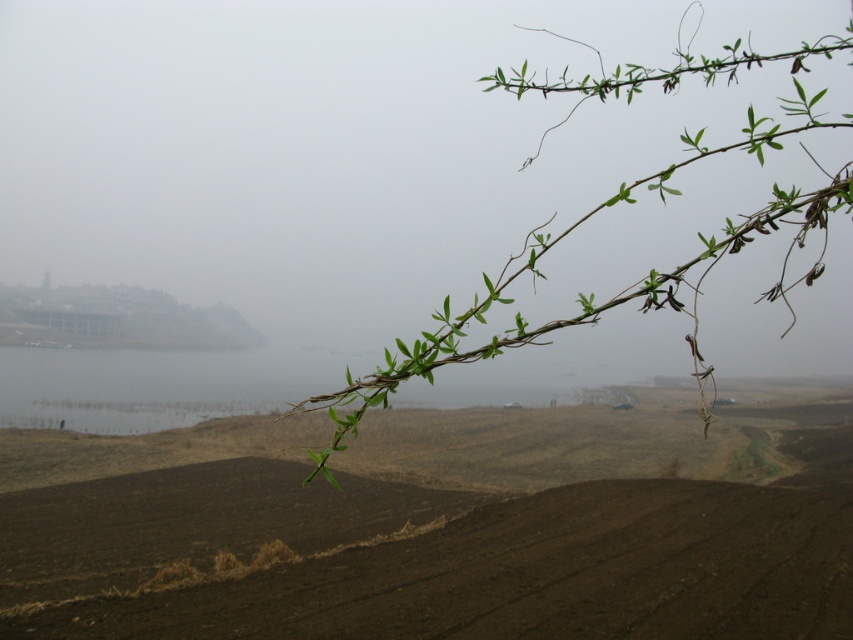
You are an artist sketching the landscape and want to place a small stone on the brown soil at center. If you want the stone to appear closer to you than the green leafy branch at upper right, where should you place it?

The brown soil at center is already further to the viewer than the green leafy branch at upper right, so placing the stone on the brown soil at center will make it appear closer to you than the green leafy branch at upper right.

You are standing in the landscape scene and want to place a small marker at each of the two points. Which point, point (106, 522) or point (650, 291), is closer to you so you can reach it first without moving?

Point (106, 522) is further to the viewer than point (650, 291), so you can reach point (106, 522) first since it is closer to you.